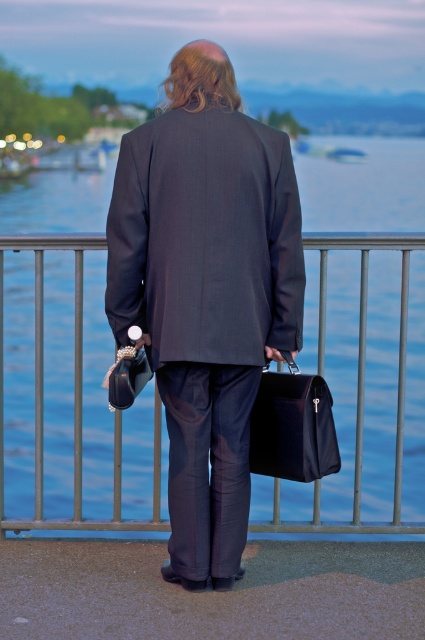
Between blue water at center and matte black briefcase at center, which one appears on the right side from the viewer's perspective?

matte black briefcase at center

Is blue water at center taller than matte black briefcase at center?

Yes.

The width and height of the screenshot is (425, 640). What do you see at coordinates (68, 371) in the screenshot? I see `blue water at center` at bounding box center [68, 371].

Where is `blue water at center`? The height and width of the screenshot is (640, 425). blue water at center is located at coordinates (68, 371).

Is point (249, 426) positioned behind point (132, 348)?

Yes, point (249, 426) is farther from viewer.

Who is shorter, matte black briefcase at center or leather textured handbag at lower center?

leather textured handbag at lower center

Does point (294, 408) come in front of point (127, 392)?

That is False.

You are a GUI agent. You are given a task and a screenshot of the screen. Output one action in this format:
    pyautogui.click(x=<x>, y=<y>)
    Task: Click on the matte black briefcase at center
    
    Given the screenshot: What is the action you would take?
    pyautogui.click(x=292, y=426)

Is dark gray pinstripe suit at center to the left of leather textured handbag at lower center from the viewer's perspective?

In fact, dark gray pinstripe suit at center is to the right of leather textured handbag at lower center.

Which of these two, dark gray pinstripe suit at center or leather textured handbag at lower center, stands taller?

Standing taller between the two is dark gray pinstripe suit at center.

Does point (127, 259) come closer to viewer compared to point (121, 390)?

That is False.

You are a GUI agent. You are given a task and a screenshot of the screen. Output one action in this format:
    pyautogui.click(x=<x>, y=<y>)
    Task: Click on the dark gray pinstripe suit at center
    The width and height of the screenshot is (425, 640).
    Given the screenshot: What is the action you would take?
    pyautogui.click(x=206, y=305)